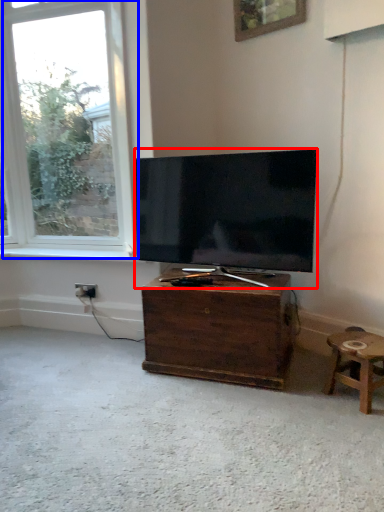
Question: Which point is further to the camera, television (highlighted by a red box) or window (highlighted by a blue box)?

Choices:
 (A) television
 (B) window

Answer: (B)